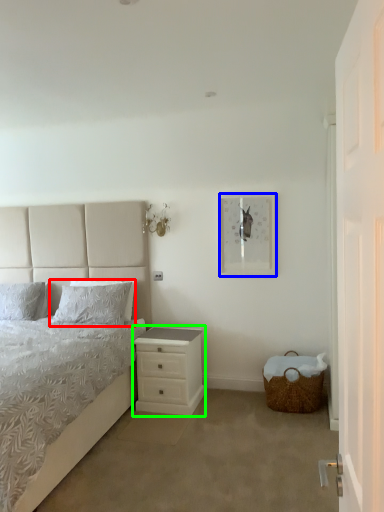
Question: Which is nearer to the pillow (highlighted by a red box)? picture frame (highlighted by a blue box) or nightstand (highlighted by a green box).

Choices:
 (A) picture frame
 (B) nightstand

Answer: (B)